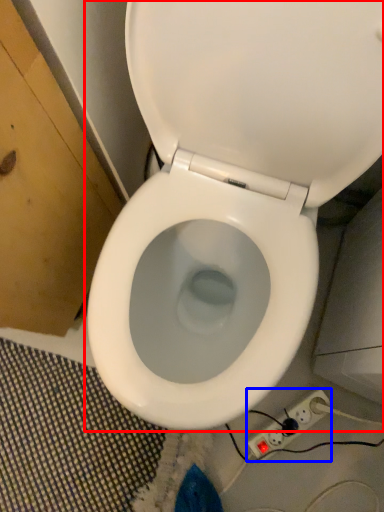
Question: Which point is closer to the camera, toilet (highlighted by a red box) or electric outlet (highlighted by a blue box)?

Choices:
 (A) toilet
 (B) electric outlet

Answer: (A)